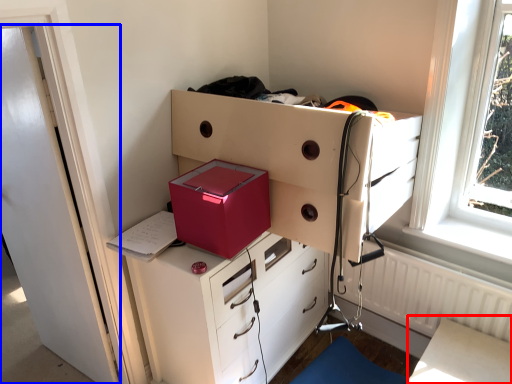
Question: Which object is further to the camera taking this photo, table (highlighted by a red box) or door (highlighted by a blue box)?

Choices:
 (A) table
 (B) door

Answer: (A)